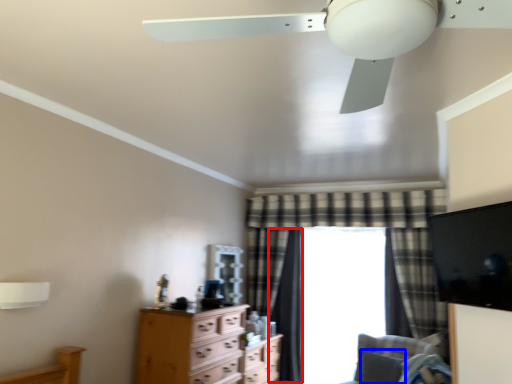
Question: Among these objects, which one is nearest to the camera, curtain (highlighted by a red box) or pillow (highlighted by a blue box)?

Choices:
 (A) curtain
 (B) pillow

Answer: (B)